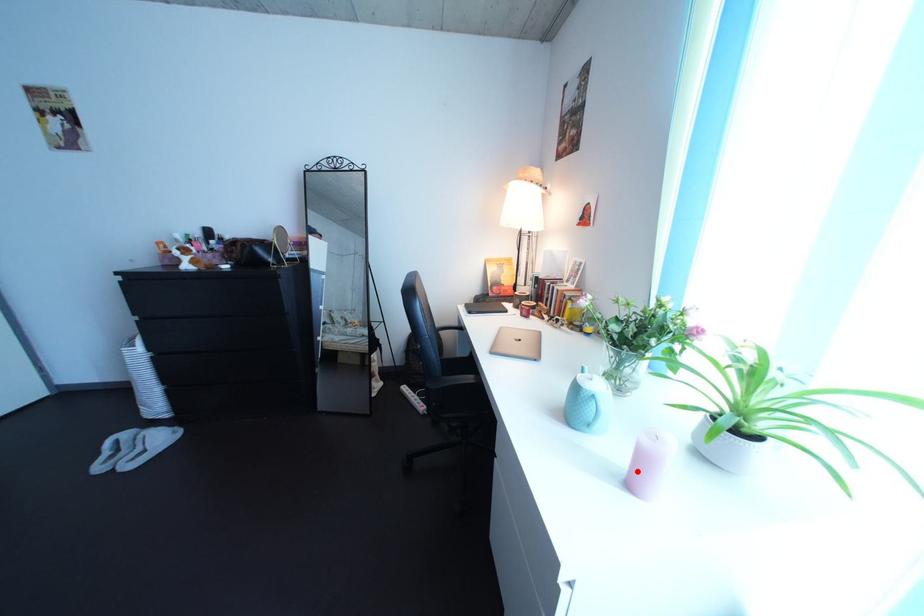
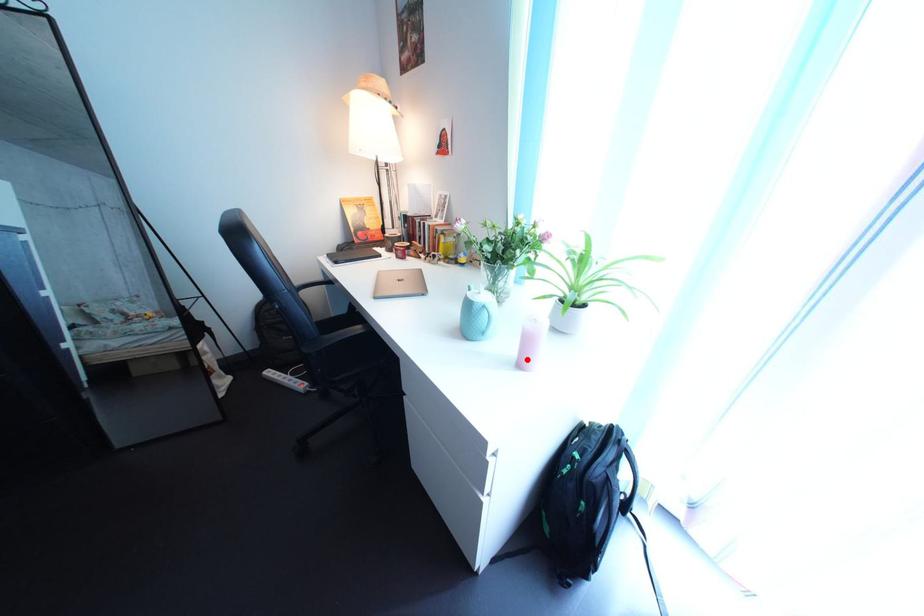
I am providing you with two images of the same scene from different viewpoints. A red point is marked on the first image and another point is marked on the second image. Is the marked point in image1 the same physical position as the marked point in image2?

Yes